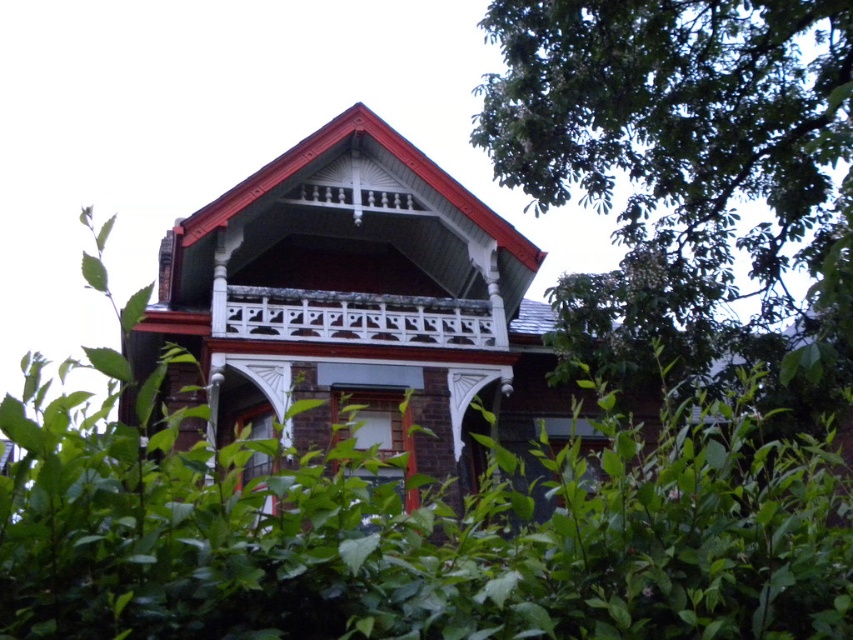
Question: Which point is closer to the camera taking this photo?

Choices:
 (A) click(x=322, y=300)
 (B) click(x=622, y=104)

Answer: (B)

Question: Observing the image, what is the correct spatial positioning of green leafy tree at upper right in reference to white painted wood balcony at upper center?

Choices:
 (A) above
 (B) below

Answer: (A)

Question: Can you confirm if green leafy tree at upper right is thinner than white painted wood balcony at upper center?

Choices:
 (A) no
 (B) yes

Answer: (A)

Question: Observing the image, what is the correct spatial positioning of green leafy tree at upper right in reference to white painted wood balcony at upper center?

Choices:
 (A) left
 (B) right

Answer: (B)